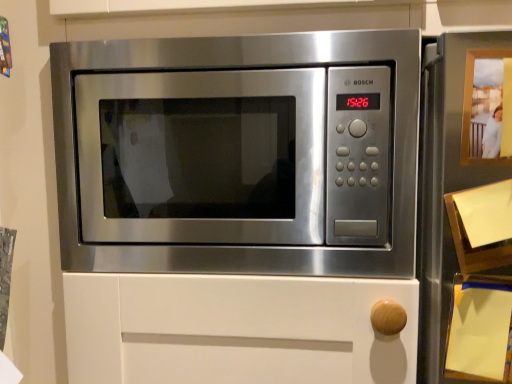
Question: Considering the positions of point (507, 94) and point (59, 183), is point (507, 94) closer or farther from the camera than point (59, 183)?

Choices:
 (A) farther
 (B) closer

Answer: (B)

Question: Is matte wood photo frame at upper right taller or shorter than stainless steel microwave at center?

Choices:
 (A) short
 (B) tall

Answer: (A)

Question: From the image's perspective, is matte wood photo frame at upper right located above or below stainless steel microwave at center?

Choices:
 (A) below
 (B) above

Answer: (B)

Question: From a real-world perspective, is stainless steel microwave at center positioned above or below matte wood photo frame at upper right?

Choices:
 (A) below
 (B) above

Answer: (A)

Question: From the image's perspective, is stainless steel microwave at center positioned above or below matte wood photo frame at upper right?

Choices:
 (A) below
 (B) above

Answer: (A)

Question: Based on their sizes in the image, would you say stainless steel microwave at center is bigger or smaller than matte wood photo frame at upper right?

Choices:
 (A) big
 (B) small

Answer: (A)

Question: In the image, is stainless steel microwave at center on the left side or the right side of matte wood photo frame at upper right?

Choices:
 (A) left
 (B) right

Answer: (A)